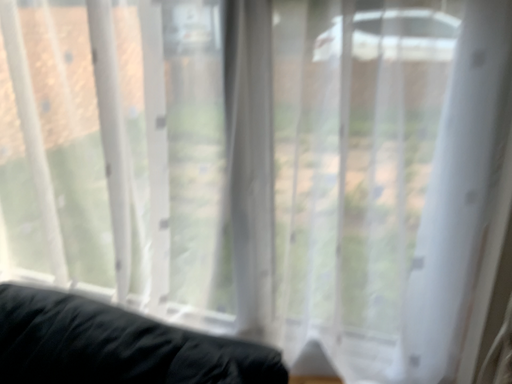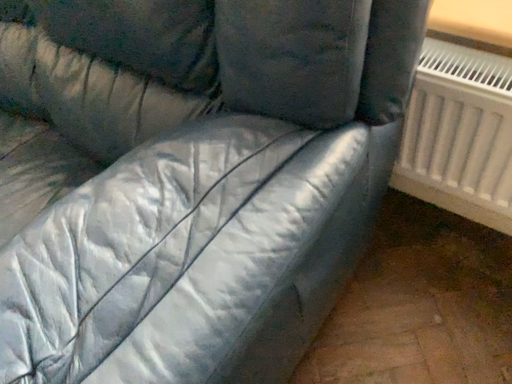
Question: Which way did the camera rotate in the video?

Choices:
 (A) rotated left
 (B) rotated right

Answer: (A)